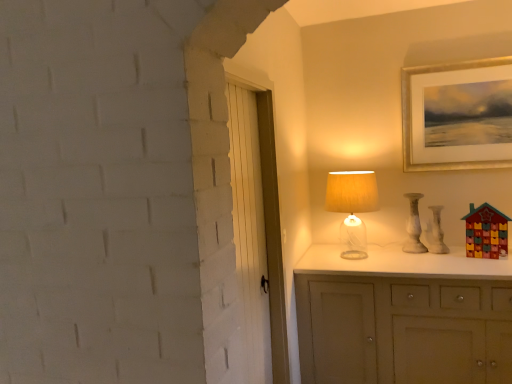
Question: Is white marble vase at right not near translucent glass table lamp at upper right?

Choices:
 (A) yes
 (B) no

Answer: (B)

Question: Considering the relative sizes of white marble vase at right and translucent glass table lamp at upper right in the image provided, is white marble vase at right thinner than translucent glass table lamp at upper right?

Choices:
 (A) yes
 (B) no

Answer: (A)

Question: From the image's perspective, is white marble vase at right above translucent glass table lamp at upper right?

Choices:
 (A) no
 (B) yes

Answer: (A)

Question: From a real-world perspective, is white marble vase at right below translucent glass table lamp at upper right?

Choices:
 (A) yes
 (B) no

Answer: (A)

Question: Does white marble vase at right appear on the right side of translucent glass table lamp at upper right?

Choices:
 (A) yes
 (B) no

Answer: (A)

Question: Is the position of white marble vase at right more distant than that of translucent glass table lamp at upper right?

Choices:
 (A) yes
 (B) no

Answer: (A)

Question: Could you tell me if white marble vase at right is turned towards white marble vase at right?

Choices:
 (A) yes
 (B) no

Answer: (B)

Question: From a real-world perspective, is white marble vase at right over white marble vase at right?

Choices:
 (A) yes
 (B) no

Answer: (B)

Question: From a real-world perspective, is white marble vase at right below white marble vase at right?

Choices:
 (A) no
 (B) yes

Answer: (B)

Question: Can you confirm if white marble vase at right is smaller than white marble vase at right?

Choices:
 (A) no
 (B) yes

Answer: (B)

Question: Would you consider white marble vase at right to be distant from white marble vase at right?

Choices:
 (A) yes
 (B) no

Answer: (B)

Question: Considering the relative sizes of white marble vase at right and white marble vase at right in the image provided, is white marble vase at right wider than white marble vase at right?

Choices:
 (A) yes
 (B) no

Answer: (A)

Question: Are gold-framed picture at upper right and translucent glass table lamp at upper right making contact?

Choices:
 (A) yes
 (B) no

Answer: (B)